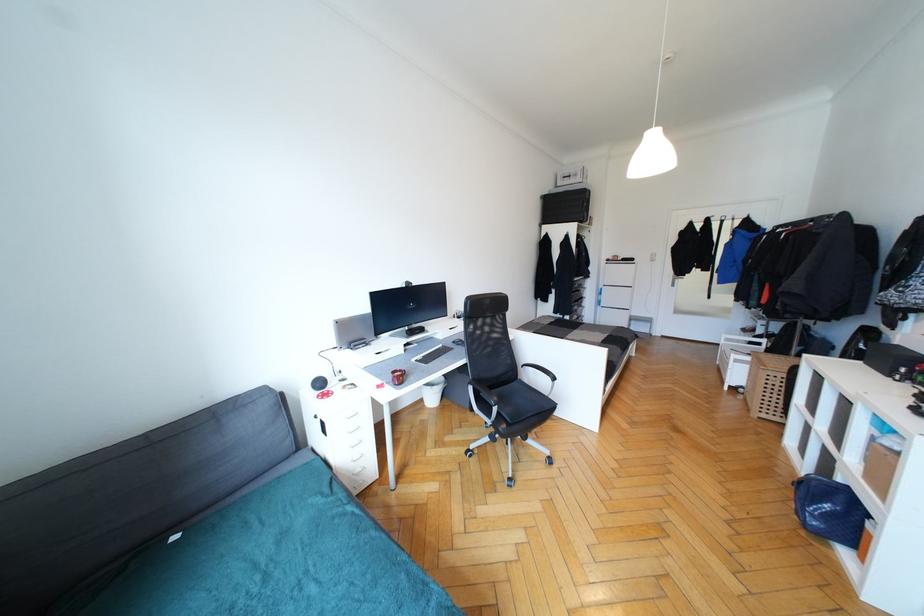
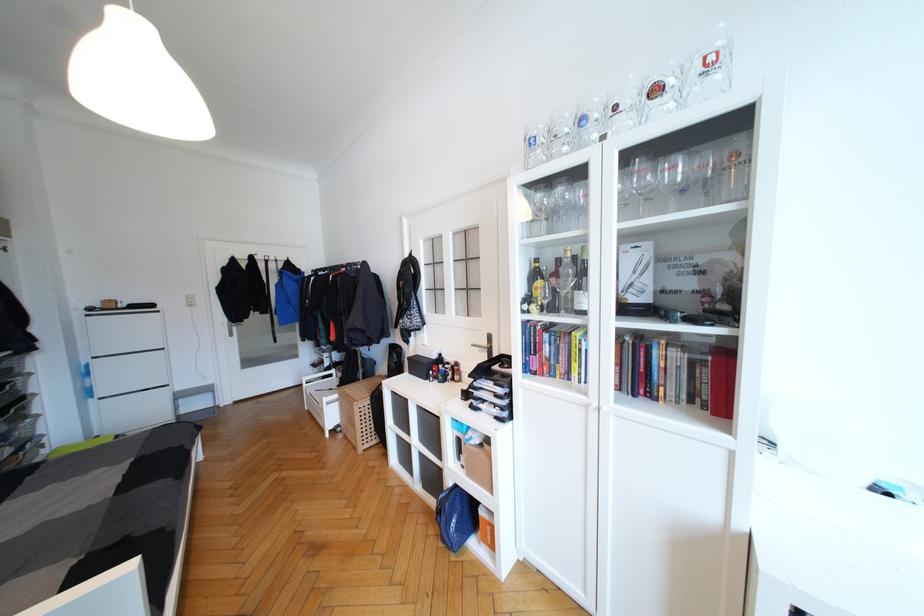
Where in the second image is the point corresponding to pixel 749 368 from the first image?

(339, 405)